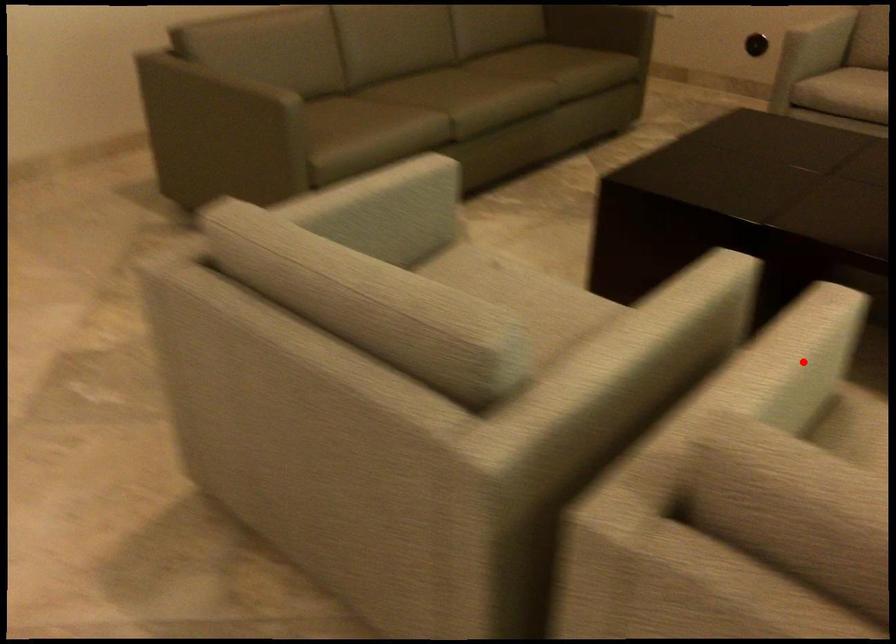
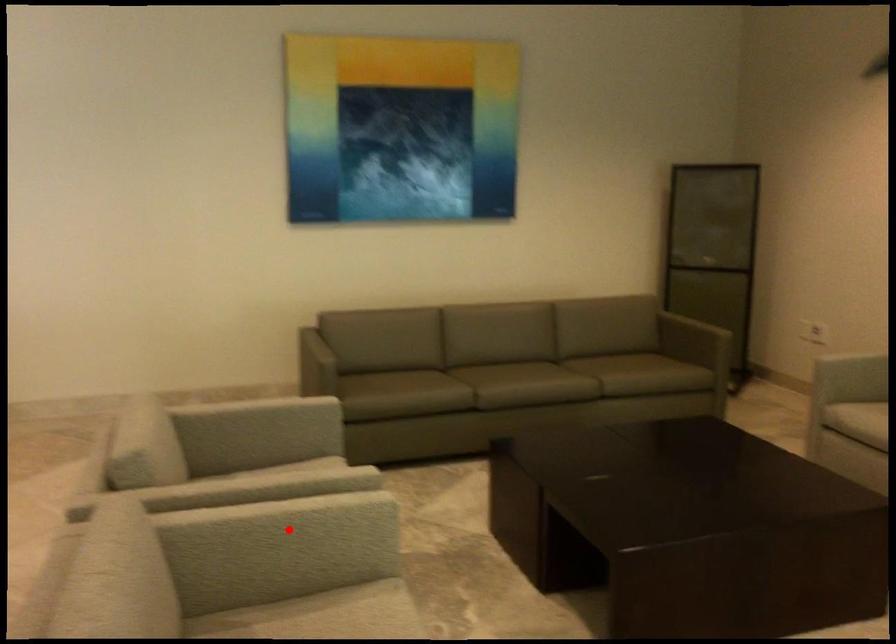
I am providing you with two images of the same scene from different viewpoints. A red point is marked on the first image and another point is marked on the second image. Does the point marked in image1 correspond to the same location as the one in image2?

Yes